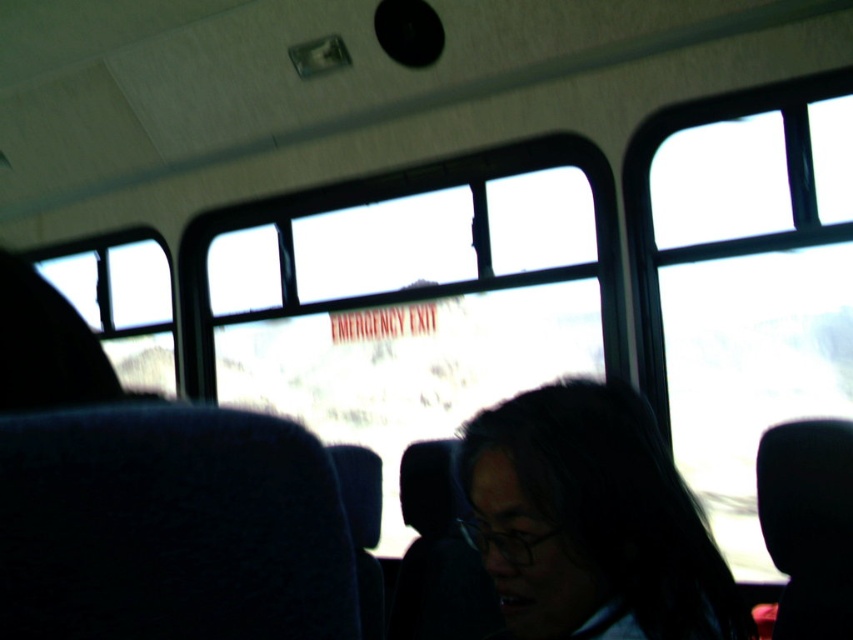
Question: Can you confirm if transparent glass window at upper right is positioned to the left of black matte hair at center?

Choices:
 (A) no
 (B) yes

Answer: (A)

Question: Is transparent glass emergency exit sign at center to the right of transparent glass window at upper right from the viewer's perspective?

Choices:
 (A) yes
 (B) no

Answer: (B)

Question: Based on their relative distances, which object is nearer to the black matte hair at center?

Choices:
 (A) transparent glass window at left
 (B) transparent glass window at upper right

Answer: (B)

Question: Which of the following is the farthest from the observer?

Choices:
 (A) black matte hair at center
 (B) transparent glass emergency exit sign at center

Answer: (B)

Question: Is transparent glass window at upper right below black matte hair at center?

Choices:
 (A) no
 (B) yes

Answer: (A)

Question: Estimate the real-world distances between objects in this image. Which object is closer to the transparent glass window at left?

Choices:
 (A) black matte hair at center
 (B) transparent glass emergency exit sign at center

Answer: (B)